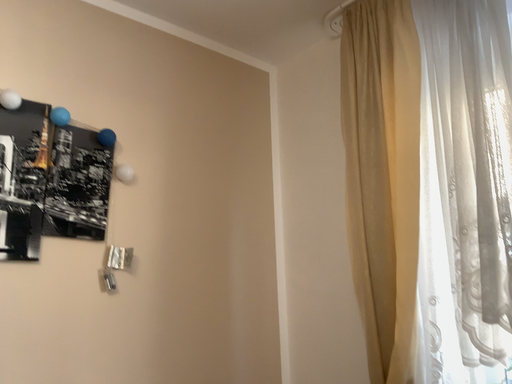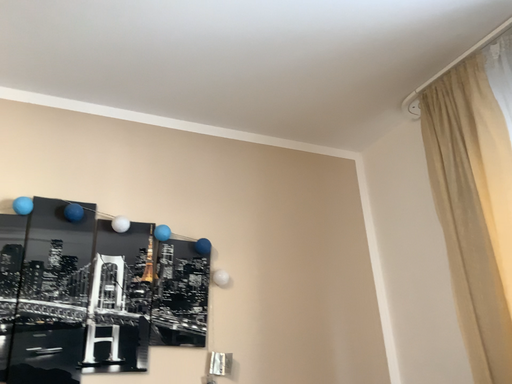
Question: How did the camera likely rotate when shooting the video?

Choices:
 (A) rotated downward
 (B) rotated upward

Answer: (B)